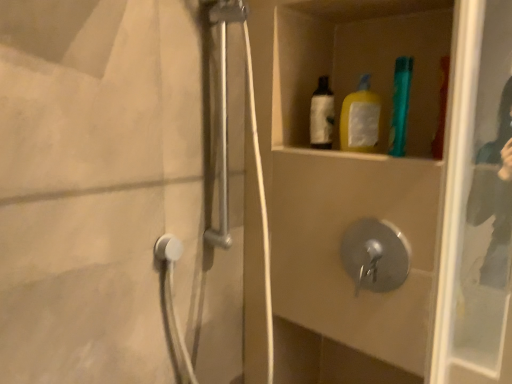
Question: Is transparent glass screen door at upper right in front of metallic silver shower door at left?

Choices:
 (A) yes
 (B) no

Answer: (A)

Question: Considering the relative sizes of transparent glass screen door at upper right and metallic silver shower door at left in the image provided, is transparent glass screen door at upper right wider than metallic silver shower door at left?

Choices:
 (A) yes
 (B) no

Answer: (A)

Question: Would you say transparent glass screen door at upper right contains metallic silver shower door at left?

Choices:
 (A) no
 (B) yes

Answer: (B)

Question: Is transparent glass screen door at upper right bigger than metallic silver shower door at left?

Choices:
 (A) no
 (B) yes

Answer: (B)

Question: From a real-world perspective, is transparent glass screen door at upper right below metallic silver shower door at left?

Choices:
 (A) yes
 (B) no

Answer: (B)

Question: Considering the relative sizes of transparent glass screen door at upper right and metallic silver shower door at left in the image provided, is transparent glass screen door at upper right thinner than metallic silver shower door at left?

Choices:
 (A) yes
 (B) no

Answer: (B)

Question: Is teal plastic toothbrush at upper right bigger than transparent glass screen door at upper right?

Choices:
 (A) yes
 (B) no

Answer: (B)

Question: Is teal plastic toothbrush at upper right positioned far away from transparent glass screen door at upper right?

Choices:
 (A) yes
 (B) no

Answer: (B)

Question: Does teal plastic toothbrush at upper right lie in front of transparent glass screen door at upper right?

Choices:
 (A) no
 (B) yes

Answer: (A)

Question: Can you confirm if teal plastic toothbrush at upper right is taller than transparent glass screen door at upper right?

Choices:
 (A) no
 (B) yes

Answer: (A)

Question: Does teal plastic toothbrush at upper right have a greater width compared to transparent glass screen door at upper right?

Choices:
 (A) no
 (B) yes

Answer: (A)

Question: From a real-world perspective, does teal plastic toothbrush at upper right stand above transparent glass screen door at upper right?

Choices:
 (A) yes
 (B) no

Answer: (A)

Question: Considering the relative positions of transparent glass screen door at upper right and teal plastic toothbrush at upper right in the image provided, is transparent glass screen door at upper right to the right of teal plastic toothbrush at upper right from the viewer's perspective?

Choices:
 (A) no
 (B) yes

Answer: (A)